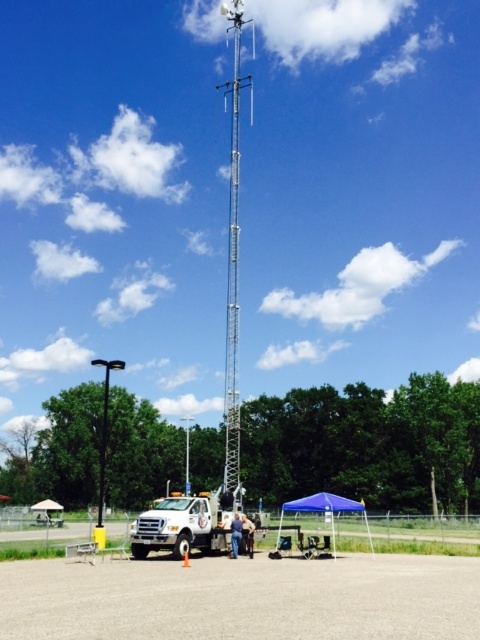
You are standing at the back of the white matte truck at lower center. Looking forward, which side should you turn to find the silver metallic antenna at center?

The silver metallic antenna at center is to the left of the white matte truck at lower center, so you should turn left to find it.

You are standing near the white matte truck at lower center and want to hand a tool to someone wearing blue jeans at center. Can you reach them without moving from your current position?

The white matte truck at lower center is closer to the viewer than blue jeans at center, so you are closer to the truck and farther from the person with blue jeans at center. You might not be able to reach them without moving.

You are a delivery person who needs to unload a package from the white matte truck at lower center. The package is placed on the blue jeans at center. To ensure safety, you need to know if the truck is taller than the jeans. Can you confirm this?

The white matte truck at lower center is taller than blue jeans at center, so yes, the truck is taller than the jeans.